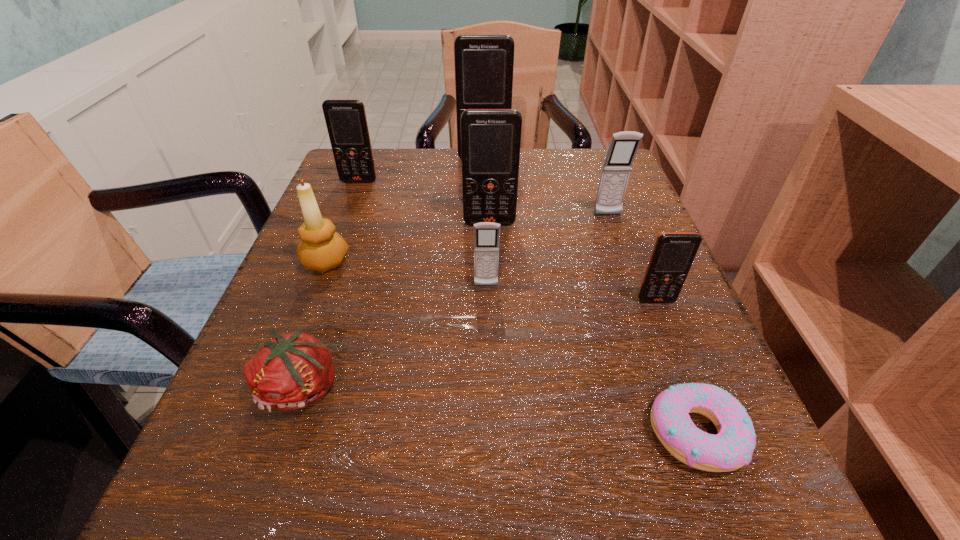
Select which object appears as the closest to the candle_holder. Please provide its 2D coordinates. Your answer should be formatted as a tuple, i.e. [(x, y)], where the tuple contains the x and y coordinates of a point satisfying the conditions above.

[(293, 370)]

Where is `the third closest object to the third farthest orange cellular telephone`? The width and height of the screenshot is (960, 540). the third closest object to the third farthest orange cellular telephone is located at coordinates (322, 248).

Locate an element on the screen. The image size is (960, 540). the sixth closest cellular telephone relative to the shortest object is located at coordinates (346, 121).

Identify which cellular telephone is the third nearest to the third nearest orange cellular telephone. Please provide its 2D coordinates. Your answer should be formatted as a tuple, i.e. [(x, y)], where the tuple contains the x and y coordinates of a point satisfying the conditions above.

[(486, 234)]

Locate an element on the screen. The image size is (960, 540). orange cellular telephone that stands as the third closest to the red tomato is located at coordinates (346, 121).

I want to click on orange cellular telephone identified as the second closest to the bigger gray cellular telephone, so click(673, 254).